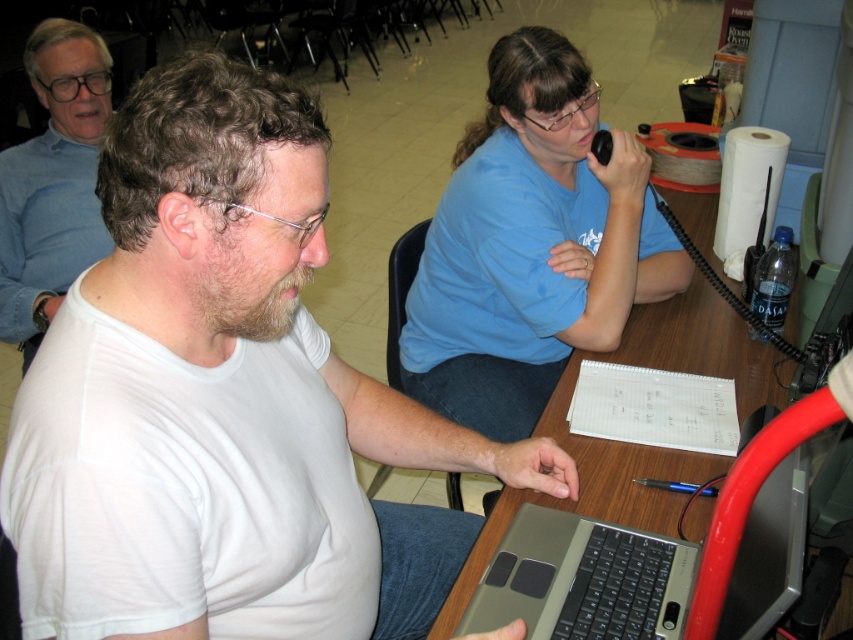
Can you confirm if white matte shirt at center is positioned below wooden table at center?

Correct, white matte shirt at center is located below wooden table at center.

Between point (352, 529) and point (665, 326), which one is positioned behind?

The point (665, 326) is behind.

At what (x,y) coordinates should I click in order to perform the action: click on white matte shirt at center. Please return your answer as a coordinate pair (x, y). The image size is (853, 640). Looking at the image, I should click on (224, 401).

Does blue cotton shirt at upper center have a smaller size compared to wooden table at center?

Yes, blue cotton shirt at upper center is smaller than wooden table at center.

Locate an element on the screen. blue cotton shirt at upper center is located at coordinates (531, 244).

Does point (292, 532) lie in front of point (531, 557)?

That is True.

Can you confirm if white matte shirt at center is shorter than silver/black laptop at lower center?

No.

Who is more forward, (288, 438) or (473, 618)?

Point (288, 438) is in front.

Image resolution: width=853 pixels, height=640 pixels. In order to click on white matte shirt at center in this screenshot , I will do `click(224, 401)`.